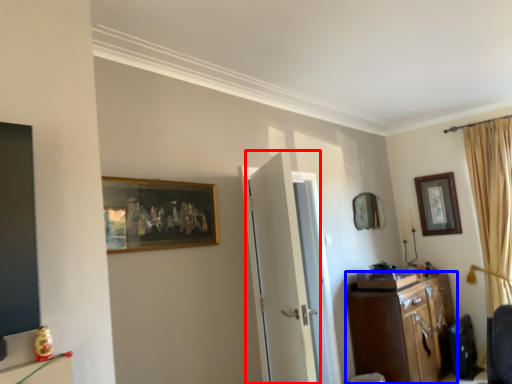
Question: Which of the following is the farthest to the observer, door (highlighted by a red box) or cabinetry (highlighted by a blue box)?

Choices:
 (A) door
 (B) cabinetry

Answer: (B)